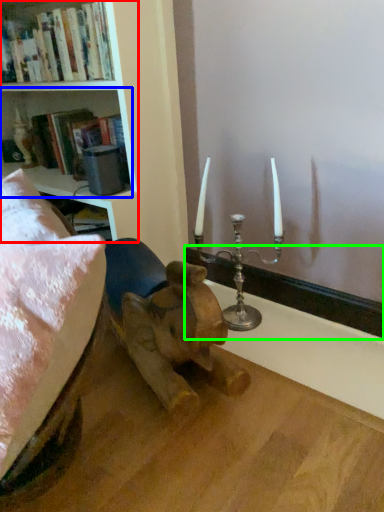
Question: Which object is the closest to the bookcase (highlighted by a red box)? Choose among these: shelf (highlighted by a blue box) or window sill (highlighted by a green box).

Choices:
 (A) shelf
 (B) window sill

Answer: (A)